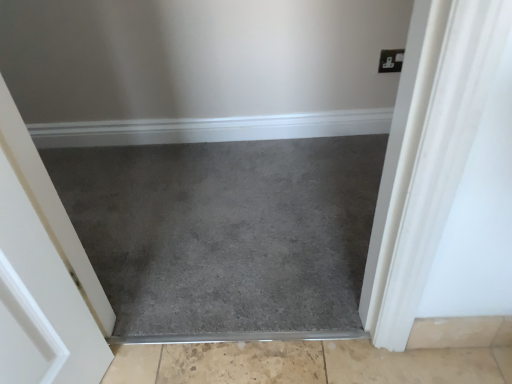
Where is `blank space situated above beige textured concrete at bottom, the 1th concrete in the bottom-to-top sequence (from a real-world perspective)`? The width and height of the screenshot is (512, 384). blank space situated above beige textured concrete at bottom, the 1th concrete in the bottom-to-top sequence (from a real-world perspective) is located at coordinates (267, 362).